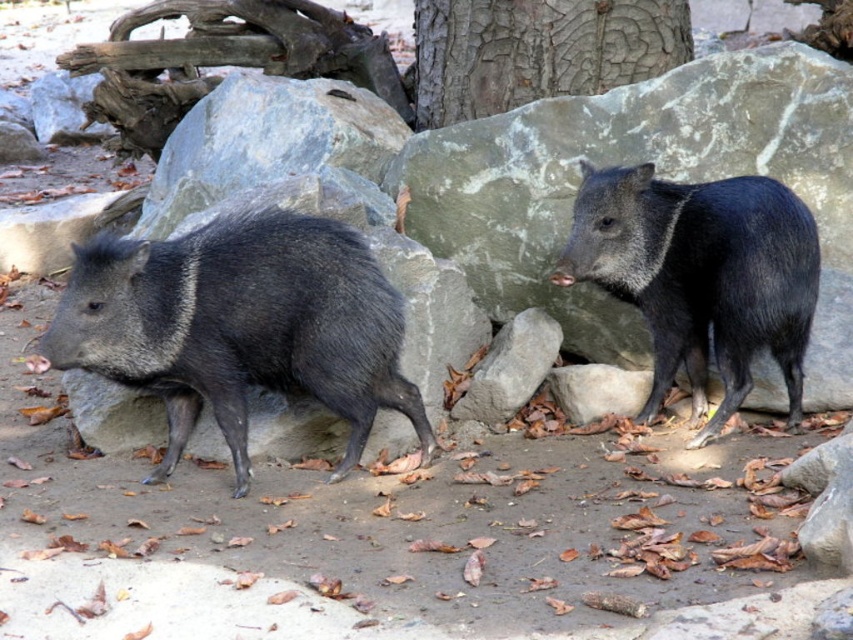
You are a zookeeper observing the peccaries. You notice the shiny black boar at left and the black glossy pig at upper right. Which peccary is located higher in the image?

The black glossy pig at upper right is higher in the image than the shiny black boar at left, as it is positioned above it.

Based on the scene description, where is the shiny black boar at left located in terms of its 2D coordinates?

The shiny black boar at left is located at the 2D coordinates of point (241, 326).

You are a zookeeper observing the peccaries in their enclosure. You need to approach the shiny black boar at left and the black glossy pig at upper right to provide food. Which peccary should you approach first to ensure you reach the closer one first?

You should approach the shiny black boar at left first because it is closer to the viewer than the black glossy pig at upper right.